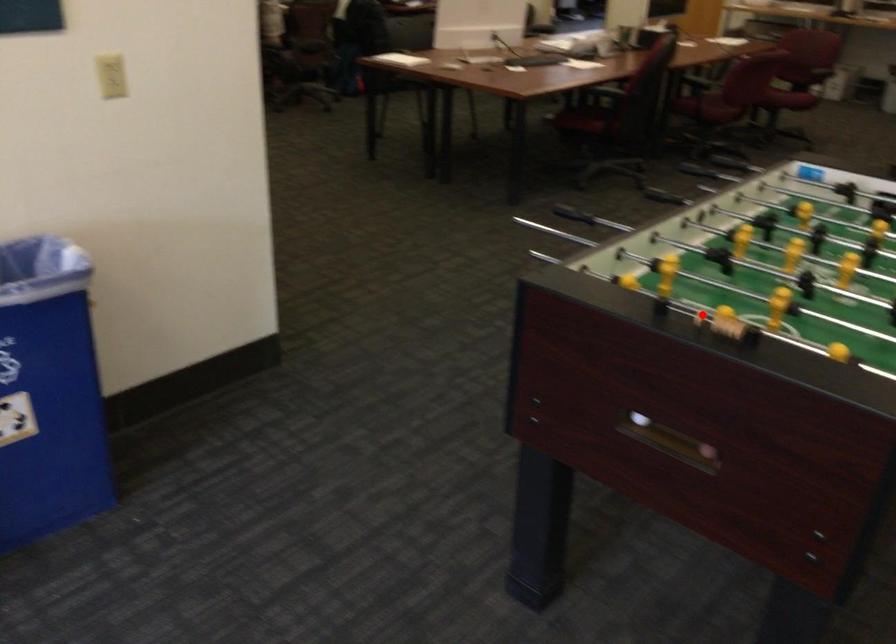
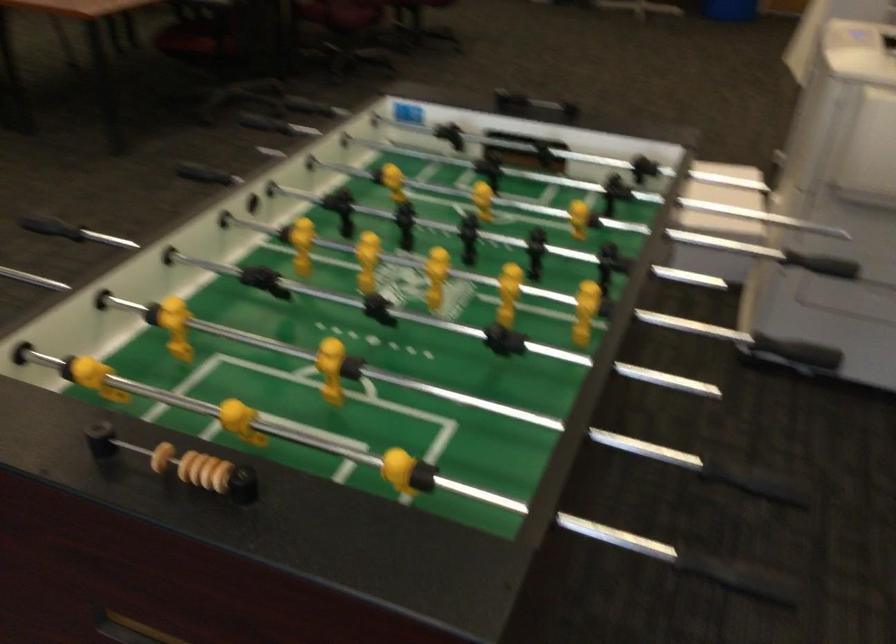
Question: I am providing you with two images of the same scene from different viewpoints. Given a red point in image1, look at the same physical point in image2. Is it:

Choices:
 (A) Closer to the viewpoint
 (B) Farther from the viewpoint

Answer: (A)